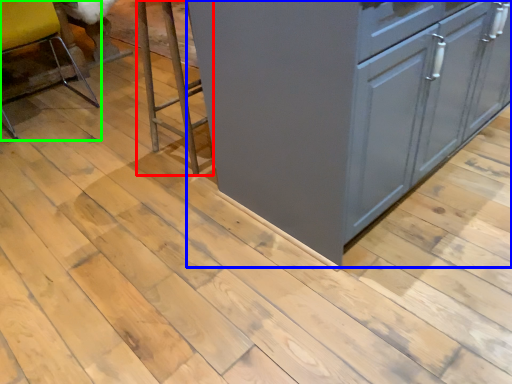
Question: Which object is the farthest from step stool (highlighted by a red box)? Choose among these: cabinetry (highlighted by a blue box) or chair (highlighted by a green box).

Choices:
 (A) cabinetry
 (B) chair

Answer: (B)